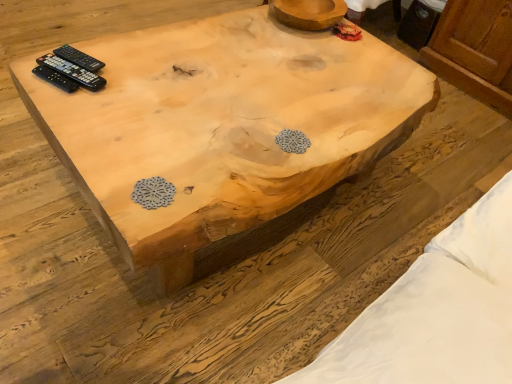
You are a GUI agent. You are given a task and a screenshot of the screen. Output one action in this format:
    pyautogui.click(x=<x>, y=<y>)
    Task: Click on the vacant area to the right of black plastic remote control at upper left, the first remote control positioned from the back
    This screenshot has height=384, width=512.
    Given the screenshot: What is the action you would take?
    [x=138, y=67]